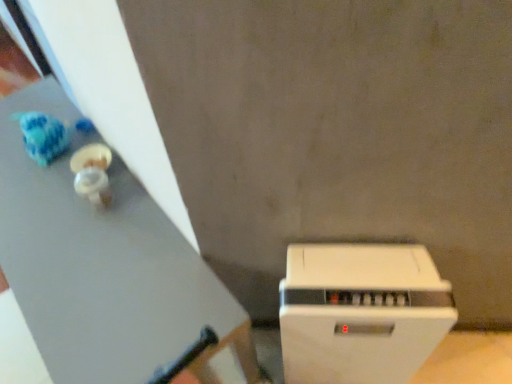
The height and width of the screenshot is (384, 512). In order to click on vacant point above white plastic toaster at lower right (from a real-world perspective) in this screenshot , I will do `click(365, 286)`.